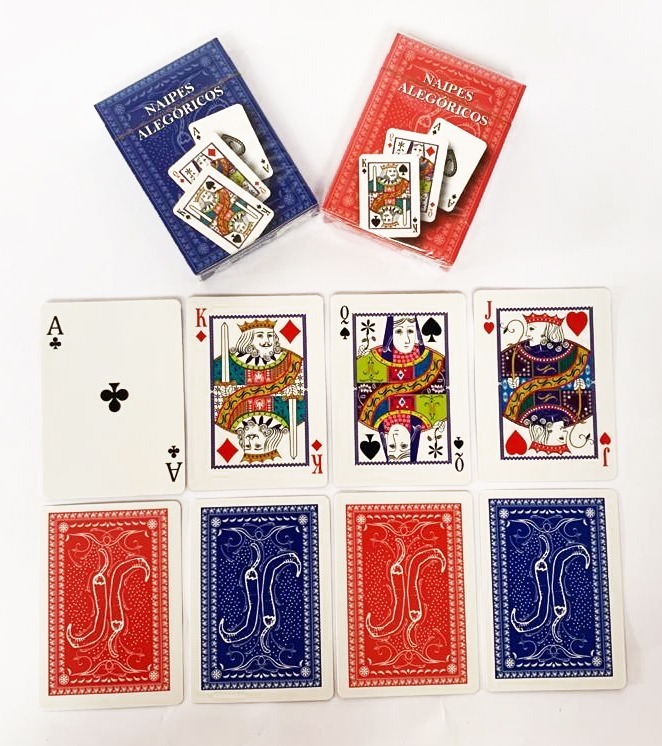
Locate an element on the screen. playing cards is located at coordinates click(81, 392), click(237, 394), click(538, 392), click(544, 588), click(375, 397), click(391, 595), click(265, 598), click(89, 608).